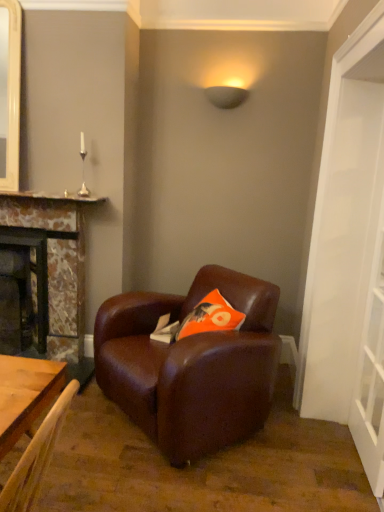
Question: From a real-world perspective, is orange fabric pillow at center physically located above or below matte stone fireplace at left, acting as the 2th fireplace starting from the right?

Choices:
 (A) above
 (B) below

Answer: (A)

Question: Would you say orange fabric pillow at center is inside or outside matte stone fireplace at left, which appears as the first fireplace when viewed from the left?

Choices:
 (A) inside
 (B) outside

Answer: (B)

Question: Estimate the real-world distances between objects in this image. Which object is closer to the brown leather armchair at center?

Choices:
 (A) transparent glass door at right
 (B) white glossy door at right
 (C) matte black lampshade at upper center
 (D) marble fireplace at left, which is the 1th fireplace from right to left
 (E) matte stone fireplace at left, acting as the 2th fireplace starting from the right

Answer: (B)

Question: Based on their relative distances, which object is farther from the orange fabric pillow at center?

Choices:
 (A) marble fireplace at left, the 2th fireplace in the left-to-right sequence
 (B) matte black lampshade at upper center
 (C) brown leather armchair at center
 (D) transparent glass door at right
 (E) white glossy door at right

Answer: (B)